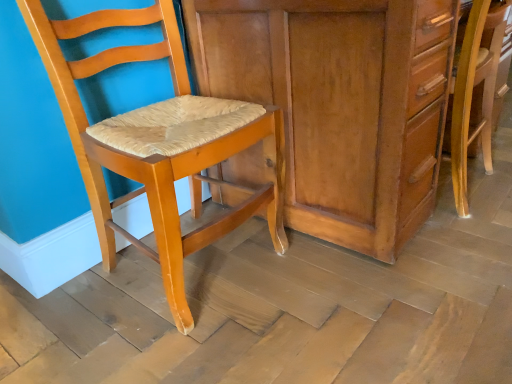
What do you see at coordinates (155, 154) in the screenshot?
I see `matte wood chair at left, positioned as the second chair in right-to-left order` at bounding box center [155, 154].

What do you see at coordinates (340, 104) in the screenshot? The height and width of the screenshot is (384, 512). I see `matte wood cabinet at center` at bounding box center [340, 104].

The width and height of the screenshot is (512, 384). Identify the location of matte wood cabinet at center. (340, 104).

Locate an element on the screen. Image resolution: width=512 pixels, height=384 pixels. wooden chair at right, acting as the 2th chair starting from the left is located at coordinates (473, 91).

From a real-world perspective, between matte wood chair at left, positioned as the second chair in right-to-left order, and wooden chair at right, acting as the 2th chair starting from the left, who is vertically higher?

matte wood chair at left, positioned as the second chair in right-to-left order, from a real-world perspective.

Where is `chair in front of the wooden chair at right, acting as the 2th chair starting from the left`? chair in front of the wooden chair at right, acting as the 2th chair starting from the left is located at coordinates (155, 154).

Considering the relative sizes of matte wood chair at left, positioned as the second chair in right-to-left order, and wooden chair at right, the first chair in the right-to-left sequence, in the image provided, is matte wood chair at left, positioned as the second chair in right-to-left order, wider than wooden chair at right, the first chair in the right-to-left sequence,?

Yes.

Consider the image. From the image's perspective, between matte wood chair at left, positioned as the second chair in right-to-left order, and wooden chair at right, the first chair in the right-to-left sequence, which one is located above?

From the image's view, wooden chair at right, the first chair in the right-to-left sequence, is above.

Between wooden chair at right, acting as the 2th chair starting from the left, and matte wood cabinet at center, which one appears on the right side from the viewer's perspective?

Positioned to the right is wooden chair at right, acting as the 2th chair starting from the left.

Is wooden chair at right, the first chair in the right-to-left sequence, positioned with its back to matte wood cabinet at center?

Yes, wooden chair at right, the first chair in the right-to-left sequence,'s orientation is away from matte wood cabinet at center.

Considering the relative sizes of wooden chair at right, the first chair in the right-to-left sequence, and matte wood cabinet at center in the image provided, is wooden chair at right, the first chair in the right-to-left sequence, thinner than matte wood cabinet at center?

Yes.

Which of these two, wooden chair at right, the first chair in the right-to-left sequence, or matte wood cabinet at center, stands shorter?

wooden chair at right, the first chair in the right-to-left sequence, is shorter.

Which is correct: matte wood cabinet at center is inside matte wood chair at left, positioned as the second chair in right-to-left order, or outside of it?

matte wood cabinet at center is spatially situated outside matte wood chair at left, positioned as the second chair in right-to-left order.

Between matte wood cabinet at center and matte wood chair at left, the 1th chair when ordered from left to right, which one has larger width?

Wider between the two is matte wood cabinet at center.

Is matte wood cabinet at center touching matte wood chair at left, positioned as the second chair in right-to-left order?

matte wood cabinet at center and matte wood chair at left, positioned as the second chair in right-to-left order, are clearly separated.

The height and width of the screenshot is (384, 512). Find the location of `chair on the left of matte wood cabinet at center`. chair on the left of matte wood cabinet at center is located at coordinates (155, 154).

Consider the image. Is wooden chair at right, the first chair in the right-to-left sequence, next to matte wood chair at left, the 1th chair when ordered from left to right, and touching it?

No.

How distant is wooden chair at right, acting as the 2th chair starting from the left, from matte wood chair at left, positioned as the second chair in right-to-left order?

wooden chair at right, acting as the 2th chair starting from the left, and matte wood chair at left, positioned as the second chair in right-to-left order, are 32.51 inches apart.

Considering the positions of objects wooden chair at right, acting as the 2th chair starting from the left, and matte wood chair at left, positioned as the second chair in right-to-left order, in the image provided, who is behind, wooden chair at right, acting as the 2th chair starting from the left, or matte wood chair at left, positioned as the second chair in right-to-left order,?

wooden chair at right, acting as the 2th chair starting from the left, is further from the camera.

From a real-world perspective, between wooden chair at right, the first chair in the right-to-left sequence, and matte wood chair at left, positioned as the second chair in right-to-left order, who is vertically lower?

From a 3D spatial view, wooden chair at right, the first chair in the right-to-left sequence, is below.

Does matte wood chair at left, the 1th chair when ordered from left to right, have a lesser width compared to matte wood cabinet at center?

Correct, the width of matte wood chair at left, the 1th chair when ordered from left to right, is less than that of matte wood cabinet at center.

I want to click on cabinetry located behind the matte wood chair at left, the 1th chair when ordered from left to right, so click(x=340, y=104).

Is matte wood chair at left, positioned as the second chair in right-to-left order, outside of matte wood cabinet at center?

Yes, matte wood chair at left, positioned as the second chair in right-to-left order, is outside of matte wood cabinet at center.

Does matte wood chair at left, positioned as the second chair in right-to-left order, have a lesser height compared to matte wood cabinet at center?

No, matte wood chair at left, positioned as the second chair in right-to-left order, is not shorter than matte wood cabinet at center.

Considering the positions of point (442, 36) and point (481, 37), is point (442, 36) closer or farther from the camera than point (481, 37)?

Clearly, point (442, 36) is closer to the camera than point (481, 37).

Which of these two, matte wood cabinet at center or wooden chair at right, acting as the 2th chair starting from the left, is bigger?

Bigger between the two is matte wood cabinet at center.

Based on the photo, is wooden chair at right, the first chair in the right-to-left sequence, located within matte wood cabinet at center?

Yes, wooden chair at right, the first chair in the right-to-left sequence, is inside matte wood cabinet at center.

Is matte wood cabinet at center aimed at wooden chair at right, acting as the 2th chair starting from the left?

Yes, matte wood cabinet at center is aimed at wooden chair at right, acting as the 2th chair starting from the left.

Locate an element on the screen. The height and width of the screenshot is (384, 512). chair above the wooden chair at right, the first chair in the right-to-left sequence (from a real-world perspective) is located at coordinates (155, 154).

This screenshot has width=512, height=384. I want to click on cabinetry above the wooden chair at right, acting as the 2th chair starting from the left (from the image's perspective), so click(x=340, y=104).

When comparing their distances from matte wood cabinet at center, does matte wood chair at left, the 1th chair when ordered from left to right, or wooden chair at right, the first chair in the right-to-left sequence, seem further?

wooden chair at right, the first chair in the right-to-left sequence, is positioned further to the anchor matte wood cabinet at center.

In the scene shown: Based on their spatial positions, is wooden chair at right, acting as the 2th chair starting from the left, or matte wood chair at left, positioned as the second chair in right-to-left order, further from matte wood cabinet at center?

Among the two, wooden chair at right, acting as the 2th chair starting from the left, is located further to matte wood cabinet at center.

Looking at the image, which one is located closer to matte wood chair at left, positioned as the second chair in right-to-left order, matte wood cabinet at center or wooden chair at right, acting as the 2th chair starting from the left?

Among the two, matte wood cabinet at center is located nearer to matte wood chair at left, positioned as the second chair in right-to-left order.

Looking at the image, which one is located further to matte wood chair at left, the 1th chair when ordered from left to right, wooden chair at right, the first chair in the right-to-left sequence, or matte wood cabinet at center?

wooden chair at right, the first chair in the right-to-left sequence.

Looking at the image, which one is located closer to wooden chair at right, the first chair in the right-to-left sequence, matte wood chair at left, the 1th chair when ordered from left to right, or matte wood cabinet at center?

matte wood cabinet at center.

Based on their spatial positions, is matte wood cabinet at center or matte wood chair at left, the 1th chair when ordered from left to right, closer to wooden chair at right, the first chair in the right-to-left sequence?

matte wood cabinet at center is closer to wooden chair at right, the first chair in the right-to-left sequence.

This screenshot has width=512, height=384. I want to click on cabinetry located between matte wood chair at left, the 1th chair when ordered from left to right, and wooden chair at right, acting as the 2th chair starting from the left, in the left-right direction, so pos(340,104).